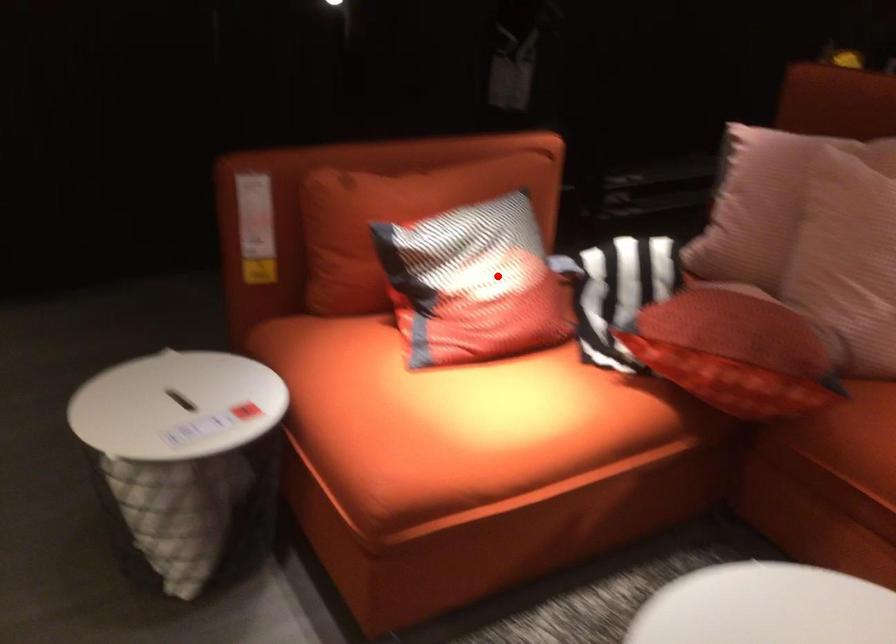
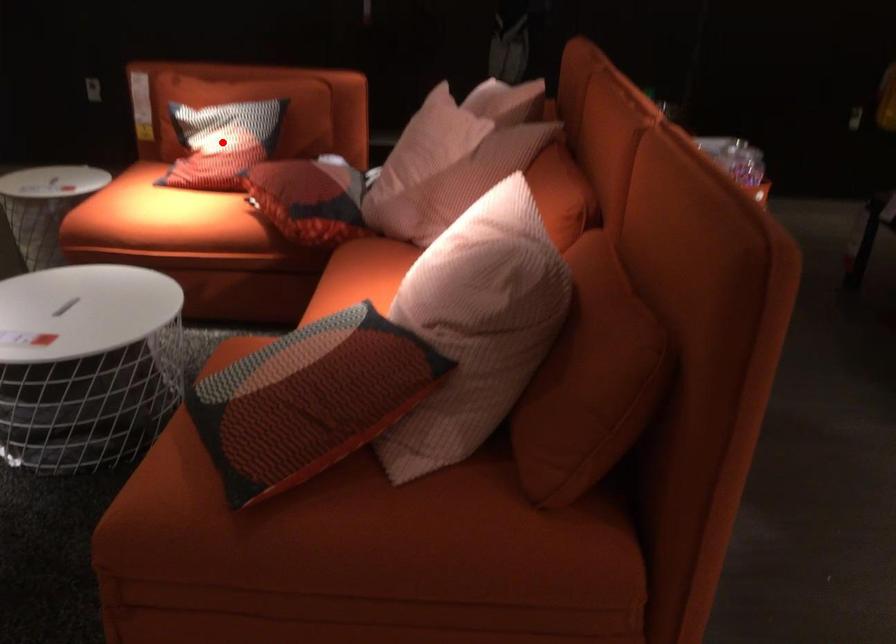
I am providing you with two images of the same scene from different viewpoints. A red point is marked on the first image and another point is marked on the second image. Does the point marked in image1 correspond to the same location as the one in image2?

Yes